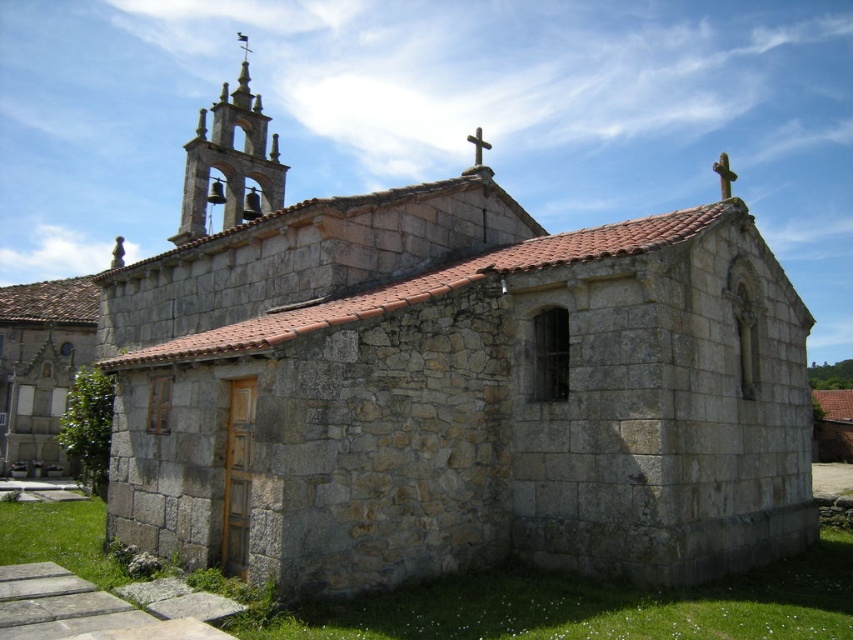
What are the coordinates of the stone bell tower at upper left in the image?

The stone bell tower at upper left is located at coordinates [229,163].

Based on the photo, you are standing at the center of the image. Which direction should you face to look towards the stone bell tower at upper left?

The stone bell tower at upper left is located at point (229, 163), which is to the upper left direction from the center. Therefore, you should face the upper left direction to look towards the stone bell tower at upper left.